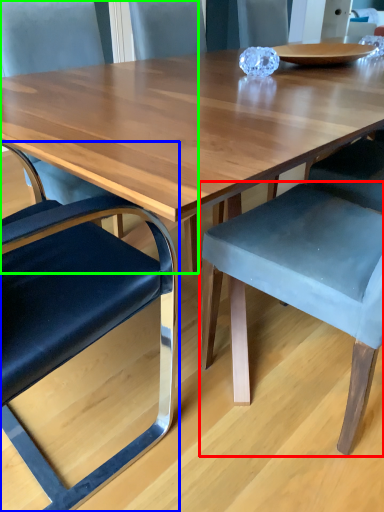
Question: Which object is the farthest from chair (highlighted by a red box)? Choose among these: chair (highlighted by a blue box) or chair (highlighted by a green box).

Choices:
 (A) chair
 (B) chair

Answer: (B)